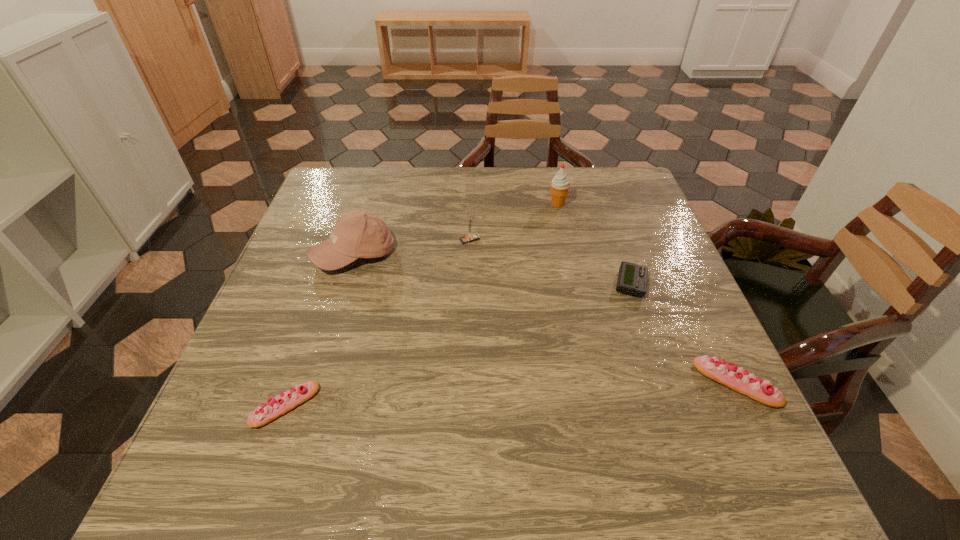
The image size is (960, 540). In order to click on eclair that is at the right edge in this screenshot , I will do `click(730, 375)`.

Where is `beeper at the right edge`? This screenshot has width=960, height=540. beeper at the right edge is located at coordinates (632, 279).

Where is `object located at the near left corner`? The image size is (960, 540). object located at the near left corner is located at coordinates point(281,404).

Where is `object at the near right corner`? Image resolution: width=960 pixels, height=540 pixels. object at the near right corner is located at coordinates (730, 375).

What are the coordinates of `free space at the far edge` in the screenshot? It's located at (580, 178).

Find the location of `vacant space at the near edge of the desktop`. vacant space at the near edge of the desktop is located at coordinates (443, 424).

Locate an element on the screen. The width and height of the screenshot is (960, 540). free space at the left edge of the desktop is located at coordinates (267, 346).

Locate an element on the screen. This screenshot has width=960, height=540. free space at the right edge is located at coordinates (662, 255).

Where is `vacant space at the far right corner of the desktop`? This screenshot has height=540, width=960. vacant space at the far right corner of the desktop is located at coordinates (600, 180).

I want to click on free spot between the second tallest object and the beeper, so click(492, 269).